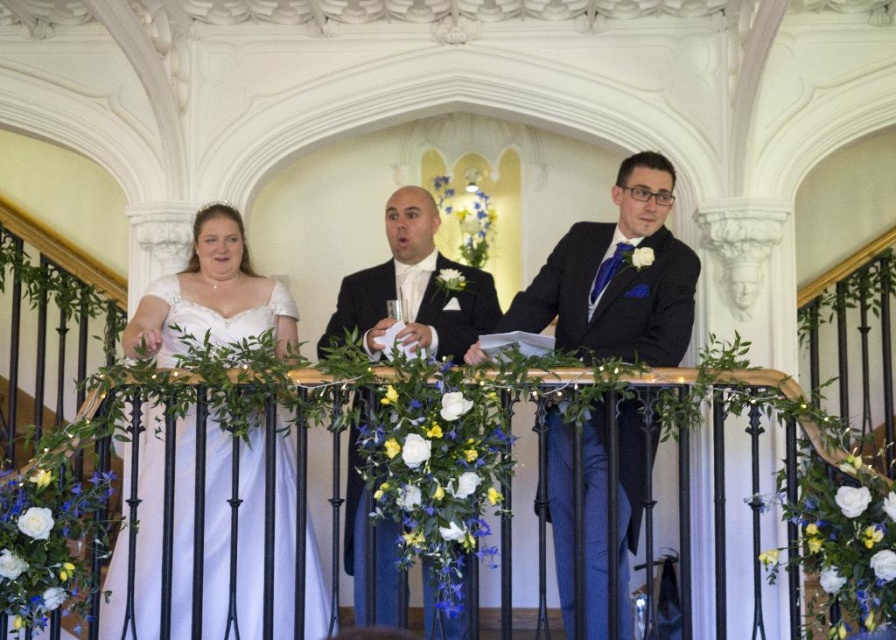
Question: Estimate the real-world distances between objects in this image. Which object is farther from the white satin dress at left?

Choices:
 (A) white satin dress at center
 (B) shiny black suit at center

Answer: (A)

Question: Is matte black suit at center thinner than shiny black suit at center?

Choices:
 (A) no
 (B) yes

Answer: (A)

Question: Estimate the real-world distances between objects in this image. Which object is farther from the shiny black suit at center?

Choices:
 (A) white satin dress at left
 (B) matte black suit at center

Answer: (A)

Question: Does white satin dress at center come behind white satin dress at left?

Choices:
 (A) no
 (B) yes

Answer: (B)

Question: Considering the relative positions of white satin dress at center and matte black suit at center in the image provided, where is white satin dress at center located with respect to matte black suit at center?

Choices:
 (A) right
 (B) left

Answer: (A)

Question: Which object is closer to the camera taking this photo?

Choices:
 (A) white satin dress at left
 (B) shiny black suit at center

Answer: (A)